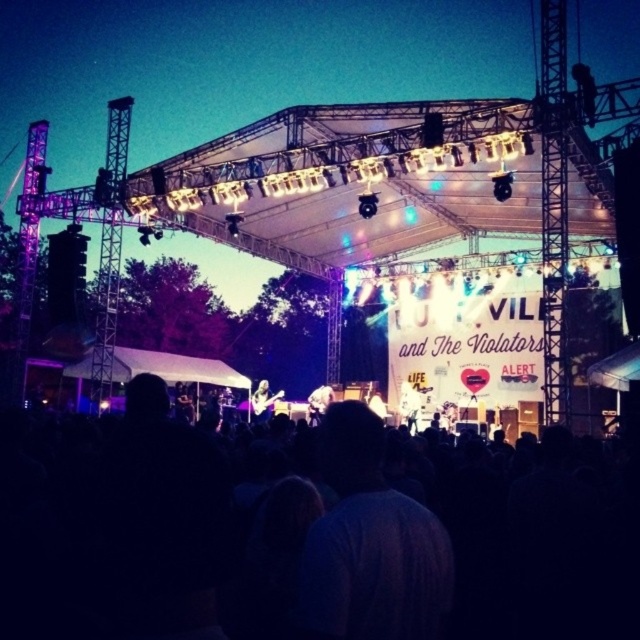
You are a stagehand preparing to set up equipment. You have two guitars, the glossy black guitar at center and the shiny black guitar at center. Which guitar should you place first if you need to arrange them from smallest to largest?

The glossy black guitar at center is smaller than the shiny black guitar at center, so you should place the glossy black guitar at center first when arranging them from smallest to largest.

You are a stagehand preparing to hang a new banner that is 2 meters wide. The current banner, the white fabric at center, is in the way. Can you replace it with the new banner without moving the glossy black guitar at center?

The white fabric at center has a width less than the glossy black guitar at center. Since the new banner is 2 meters wide, we need to check if the space allows. If the guitar is wider than the current banner, the new banner might not fit without moving the guitar. However, since the guitar is wider, replacing the banner could require adjusting the guitar position to accommodate the larger width.